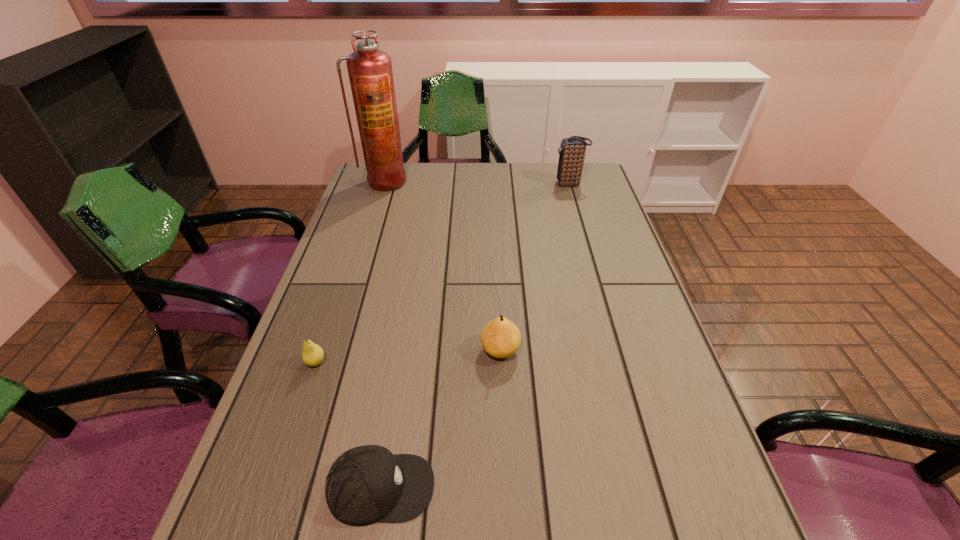
This screenshot has height=540, width=960. I want to click on free space located 0.310m with the zip open on the clutch bag, so click(x=466, y=184).

Identify the location of free location located 0.250m on the right of the third shortest object. (631, 350).

Find the location of a particular element. The width and height of the screenshot is (960, 540). free space located on the back of the left pear is located at coordinates (337, 301).

You are a GUI agent. You are given a task and a screenshot of the screen. Output one action in this format:
    pyautogui.click(x=<x>, y=<y>)
    Task: Click on the vacant space located 0.240m on the front-facing side of the cap
    The width and height of the screenshot is (960, 540).
    Given the screenshot: What is the action you would take?
    pyautogui.click(x=571, y=488)

What are the coordinates of `fire extinguisher situated at the far edge` in the screenshot? It's located at (370, 72).

This screenshot has height=540, width=960. I want to click on clutch bag present at the far edge, so click(x=572, y=151).

This screenshot has height=540, width=960. Identify the location of fire extinguisher that is at the left edge. [370, 72].

I want to click on pear present at the left edge, so click(312, 354).

You are a GUI agent. You are given a task and a screenshot of the screen. Output one action in this format:
    pyautogui.click(x=<x>, y=<y>)
    Task: Click on the cap present at the left edge
    The width and height of the screenshot is (960, 540).
    Given the screenshot: What is the action you would take?
    pyautogui.click(x=367, y=484)

This screenshot has height=540, width=960. Identify the location of object located in the right edge section of the desktop. (572, 151).